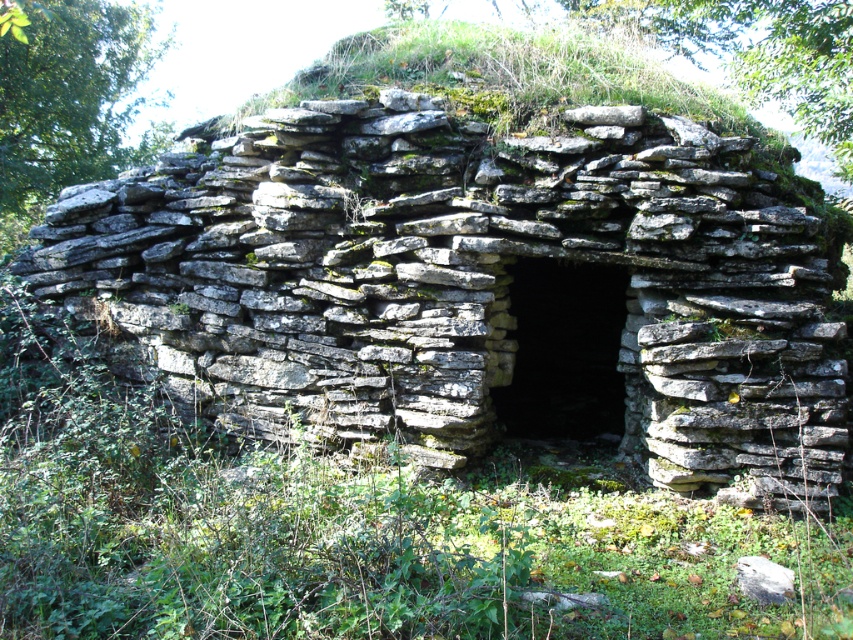
Image resolution: width=853 pixels, height=640 pixels. What do you see at coordinates (466, 284) in the screenshot?
I see `gray stone wall at center` at bounding box center [466, 284].

What are the coordinates of `gray stone wall at center` in the screenshot? It's located at (466, 284).